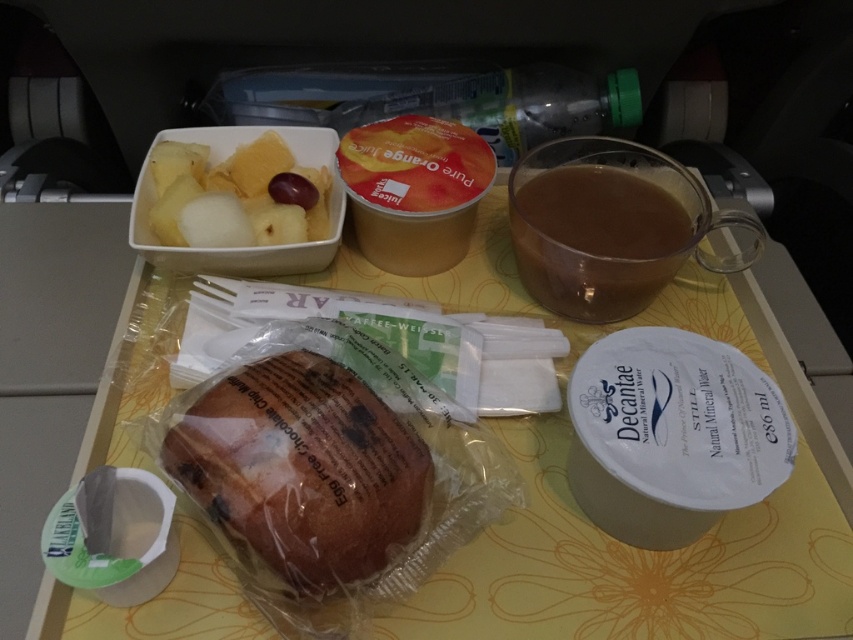
Is the position of brown translucent glass at upper right more distant than that of matte plastic fruit salad at upper left?

→ No, brown translucent glass at upper right is closer to the viewer.

Can you confirm if brown translucent glass at upper right is bigger than matte plastic fruit salad at upper left?

Indeed, brown translucent glass at upper right has a larger size compared to matte plastic fruit salad at upper left.

Is point (634, 253) closer to camera compared to point (281, 220)?

Yes.

The height and width of the screenshot is (640, 853). I want to click on brown translucent glass at upper right, so click(x=601, y=236).

Is the position of brown matte/soft bread at center more distant than that of white paper cup at upper center?

No, brown matte/soft bread at center is in front of white paper cup at upper center.

Who is higher up, brown matte/soft bread at center or white paper cup at upper center?

Positioned higher is white paper cup at upper center.

Find the location of a particular element. The height and width of the screenshot is (640, 853). brown matte/soft bread at center is located at coordinates (302, 468).

The height and width of the screenshot is (640, 853). What are the coordinates of `brown matte/soft bread at center` in the screenshot? It's located at (x=302, y=468).

Between point (228, 515) and point (543, 296), which one is positioned behind?

The point (543, 296) is behind.

Identify the location of brown matte/soft bread at center. (302, 468).

The height and width of the screenshot is (640, 853). Identify the location of brown matte/soft bread at center. (302, 468).